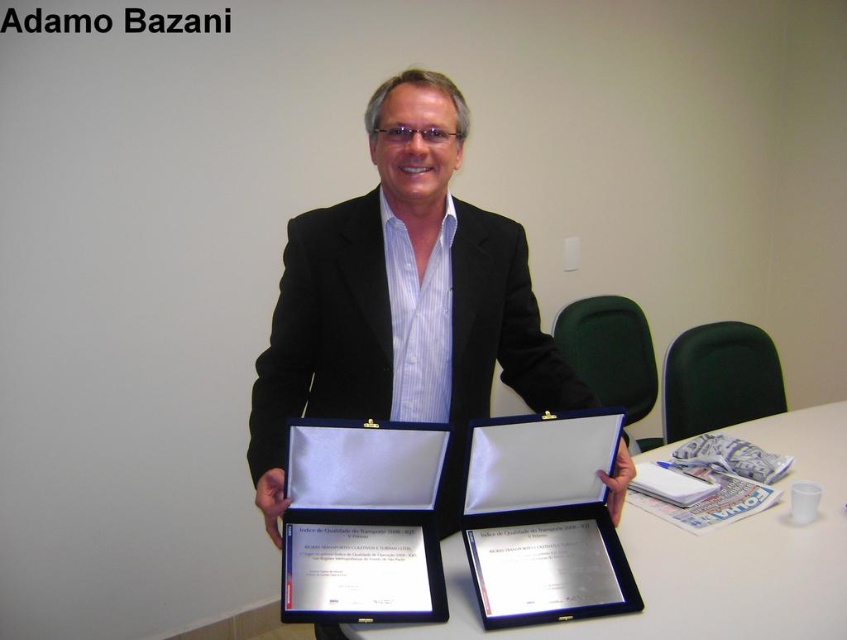
Does blue fabric table at center appear over silver metallic plaque at center?

Indeed, blue fabric table at center is positioned over silver metallic plaque at center.

Does blue fabric table at center appear on the right side of silver metallic plaque at center?

Indeed, blue fabric table at center is positioned on the right side of silver metallic plaque at center.

In the scene shown: Who is more forward, (762, 577) or (504, 529)?

Point (504, 529)

Find the location of a particular element. blue fabric table at center is located at coordinates (707, 561).

The height and width of the screenshot is (640, 847). Describe the element at coordinates (402, 301) in the screenshot. I see `black matte suit at center` at that location.

Identify the location of black matte suit at center. (402, 301).

Is point (490, 314) positioned behind point (297, 536)?

Yes, it is.

Where is `black matte suit at center`? Image resolution: width=847 pixels, height=640 pixels. black matte suit at center is located at coordinates (402, 301).

Who is more forward, (281, 465) or (728, 620)?

Point (728, 620) is more forward.

Does black matte suit at center have a greater width compared to blue fabric table at center?

No, black matte suit at center is not wider than blue fabric table at center.

Describe the element at coordinates (402, 301) in the screenshot. I see `black matte suit at center` at that location.

Where is `black matte suit at center`? Image resolution: width=847 pixels, height=640 pixels. black matte suit at center is located at coordinates (402, 301).